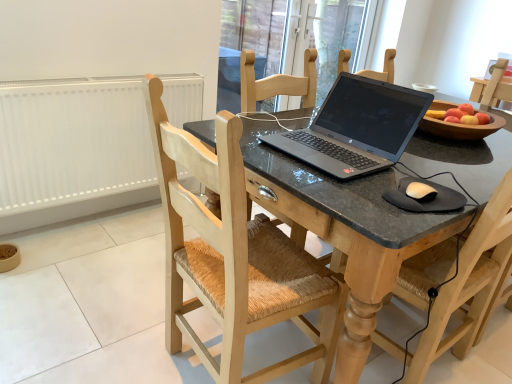
Locate an element on the screen. free region on the left part of black rubber mousepad at lower right is located at coordinates (356, 192).